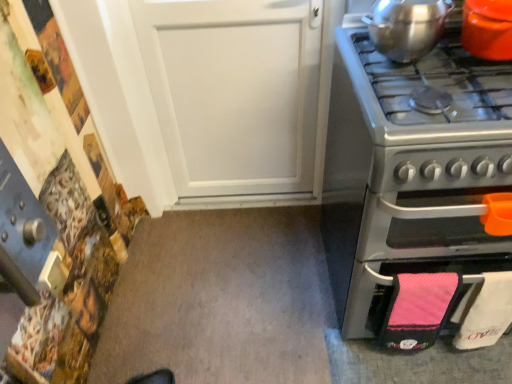
Locate an element on the screen. free location above stainless steel oven at right (from a real-world perspective) is located at coordinates (441, 91).